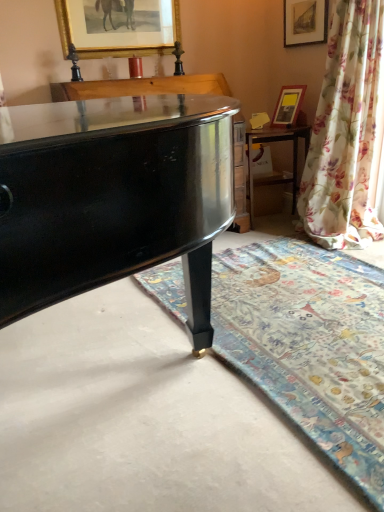
I want to click on free space underneath wooden table at right (from a real-world perspective), so click(274, 220).